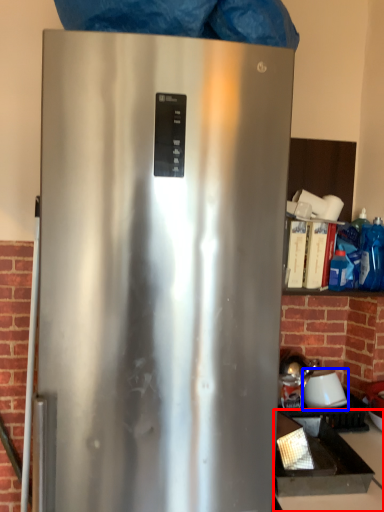
Question: Which object appears closest to the camera in this image, counter top (highlighted by a red box) or appliance (highlighted by a blue box)?

Choices:
 (A) counter top
 (B) appliance

Answer: (A)